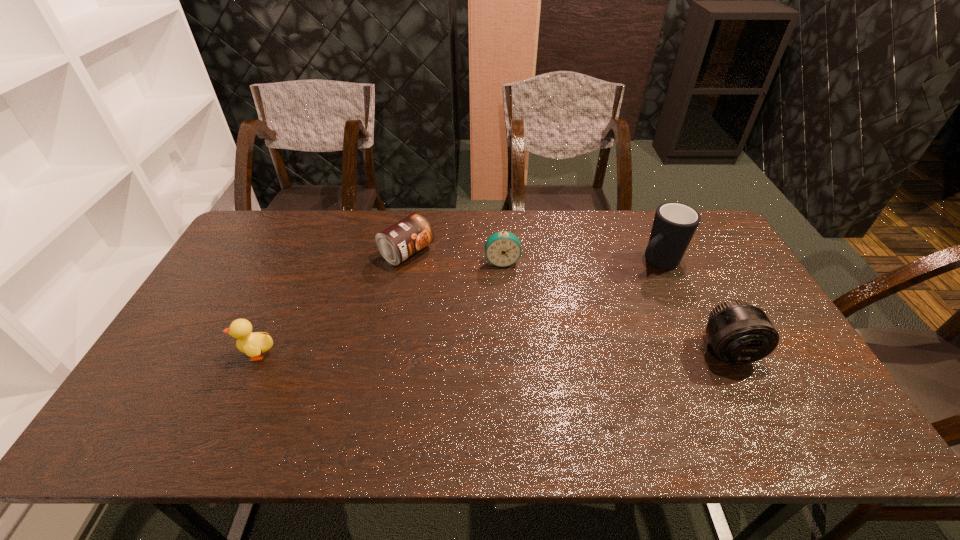
I want to click on free area in between the alarm clock and the second tallest object, so click(615, 306).

At what (x,y) coordinates should I click in order to perform the action: click on free space between the duckling and the tallest object. Please return your answer as a coordinate pair (x, y). This screenshot has height=540, width=960. Looking at the image, I should click on (457, 308).

Identify the location of vacant space that is in between the third object from left to right and the second tallest object. (615, 306).

The height and width of the screenshot is (540, 960). In order to click on empty space that is in between the leftmost object and the alarm clock in this screenshot , I will do `click(379, 307)`.

Where is `vacant space in between the leftmost object and the can`? The width and height of the screenshot is (960, 540). vacant space in between the leftmost object and the can is located at coordinates (332, 303).

Select which object is the closest to the alarm clock. Please provide its 2D coordinates. Your answer should be formatted as a tuple, i.e. [(x, y)], where the tuple contains the x and y coordinates of a point satisfying the conditions above.

[(408, 236)]

The width and height of the screenshot is (960, 540). I want to click on object that stands as the second closest to the fourth object from right to left, so click(254, 344).